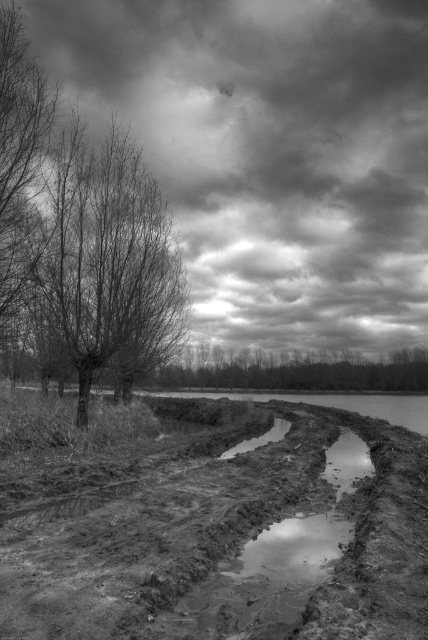
Question: Does cloudy textured sky at upper center have a larger size compared to muddy/dirt at center?

Choices:
 (A) no
 (B) yes

Answer: (B)

Question: Is cloudy textured sky at upper center bigger than muddy/dirt at center?

Choices:
 (A) yes
 (B) no

Answer: (A)

Question: From the image, what is the correct spatial relationship of cloudy textured sky at upper center in relation to glossy mud puddle at center?

Choices:
 (A) above
 (B) below

Answer: (A)

Question: Which of the following is the closest to the observer?

Choices:
 (A) muddy/dirt at center
 (B) smooth bark tree at center
 (C) cloudy textured sky at upper center
 (D) smooth bark tree at left

Answer: (A)

Question: Which object is positioned closest to the cloudy textured sky at upper center?

Choices:
 (A) muddy/dirt at center
 (B) glossy mud puddle at center
 (C) smooth bark tree at left

Answer: (C)

Question: Which point is closer to the camera?

Choices:
 (A) smooth bark tree at left
 (B) smooth bark tree at center
 (C) cloudy textured sky at upper center

Answer: (A)